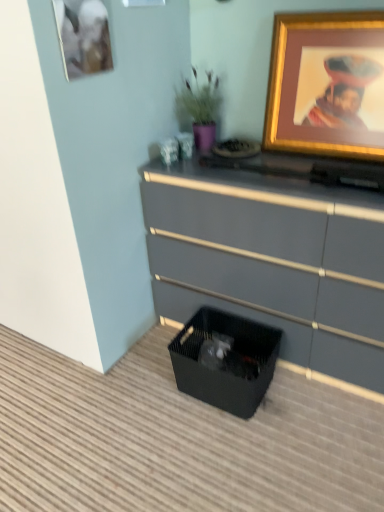
Question: Does matte gray dresser at center have a greater height compared to matte gold picture frame at upper left, the first picture frame from the left?

Choices:
 (A) no
 (B) yes

Answer: (B)

Question: Is matte gray dresser at center with matte gold picture frame at upper left, placed as the 2th picture frame when sorted from right to left?

Choices:
 (A) yes
 (B) no

Answer: (B)

Question: Would you say matte gray dresser at center is a long distance from matte gold picture frame at upper left, placed as the 2th picture frame when sorted from right to left?

Choices:
 (A) yes
 (B) no

Answer: (B)

Question: Considering the relative positions of matte gray dresser at center and matte gold picture frame at upper left, the first picture frame from the left, in the image provided, is matte gray dresser at center behind matte gold picture frame at upper left, the first picture frame from the left,?

Choices:
 (A) no
 (B) yes

Answer: (B)

Question: From the image's perspective, is matte gray dresser at center under matte gold picture frame at upper left, placed as the 2th picture frame when sorted from right to left?

Choices:
 (A) yes
 (B) no

Answer: (A)

Question: From a real-world perspective, does matte gray dresser at center stand above matte gold picture frame at upper left, placed as the 2th picture frame when sorted from right to left?

Choices:
 (A) yes
 (B) no

Answer: (B)

Question: Does matte gray dresser at center have a greater width compared to black mesh storage box at lower center?

Choices:
 (A) no
 (B) yes

Answer: (B)

Question: From the image's perspective, is matte gray dresser at center located beneath black mesh storage box at lower center?

Choices:
 (A) no
 (B) yes

Answer: (A)

Question: From a real-world perspective, is matte gray dresser at center over black mesh storage box at lower center?

Choices:
 (A) yes
 (B) no

Answer: (A)

Question: Is matte gray dresser at center far away from black mesh storage box at lower center?

Choices:
 (A) yes
 (B) no

Answer: (B)

Question: From a real-world perspective, is matte gray dresser at center under black mesh storage box at lower center?

Choices:
 (A) yes
 (B) no

Answer: (B)

Question: Does matte gray dresser at center have a smaller size compared to black mesh storage box at lower center?

Choices:
 (A) yes
 (B) no

Answer: (B)

Question: Is matte gold picture frame at upper left, the first picture frame from the left, at the back of purple matte vase at upper center?

Choices:
 (A) no
 (B) yes

Answer: (A)